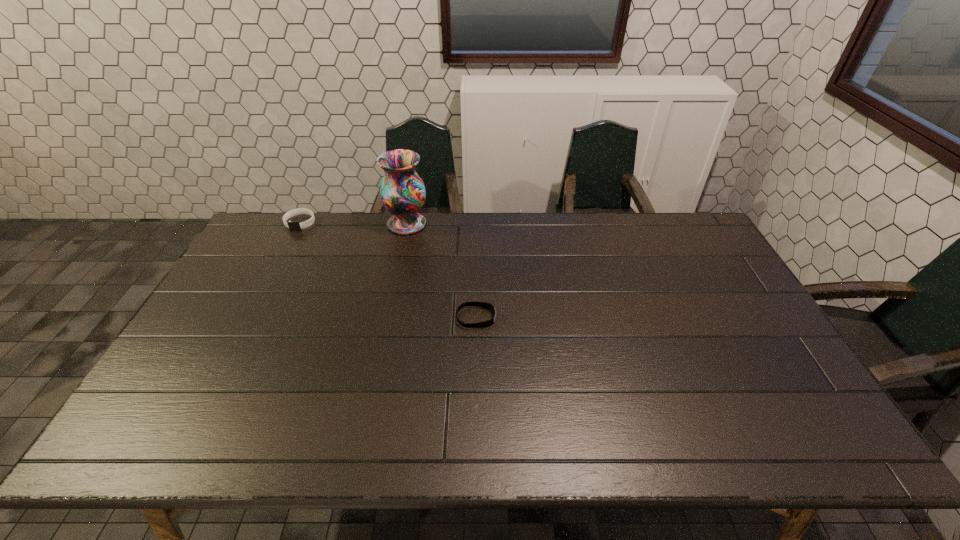
Where is `the second object from left to right`? This screenshot has width=960, height=540. the second object from left to right is located at coordinates (402, 192).

Image resolution: width=960 pixels, height=540 pixels. What are the coordinates of `the tallest object` in the screenshot? It's located at (402, 192).

The image size is (960, 540). In order to click on the farther wristband in this screenshot , I will do `click(292, 225)`.

Locate an element on the screen. This screenshot has width=960, height=540. the taller wristband is located at coordinates (292, 225).

Locate an element on the screen. The image size is (960, 540). the nearer wristband is located at coordinates (485, 305).

The height and width of the screenshot is (540, 960). I want to click on the shorter wristband, so click(485, 305).

Locate an element on the screen. vacant space located 0.270m on the front of the second object from left to right is located at coordinates (393, 290).

The width and height of the screenshot is (960, 540). Find the location of `vacant space located 0.210m on the outer surface of the second shortest object`. vacant space located 0.210m on the outer surface of the second shortest object is located at coordinates (276, 270).

You are a GUI agent. You are given a task and a screenshot of the screen. Output one action in this format:
    pyautogui.click(x=<x>, y=<y>)
    Task: Click on the free location located on the display of the right wristband
    
    Given the screenshot: What is the action you would take?
    (535, 318)

You are a GUI agent. You are given a task and a screenshot of the screen. Output one action in this format:
    pyautogui.click(x=<x>, y=<y>)
    Task: Click on the vase that is at the far edge
    
    Given the screenshot: What is the action you would take?
    pyautogui.click(x=402, y=192)